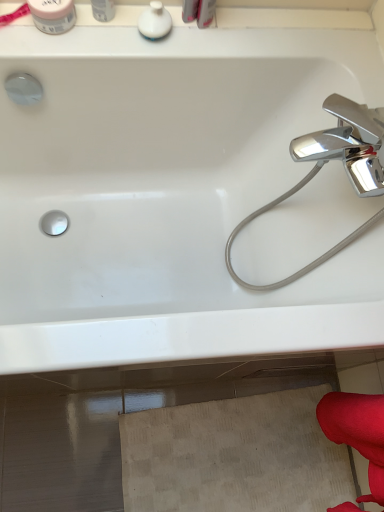
This screenshot has width=384, height=512. Describe the element at coordinates (53, 15) in the screenshot. I see `white matte jar at upper left, the 1th toiletry positioned from the left` at that location.

How much space does white glossy container at upper left, placed as the 2th toiletry when sorted from left to right, occupy horizontally?

white glossy container at upper left, placed as the 2th toiletry when sorted from left to right, is 2.18 inches in width.

Describe the element at coordinates (169, 194) in the screenshot. The height and width of the screenshot is (512, 384). I see `white glossy bathtub at upper center` at that location.

At what (x,y) coordinates should I click in order to perform the action: click on white matte jar at upper left, the 3th toiletry viewed from the right. Please return your answer as a coordinate pair (x, y). Looking at the image, I should click on (53, 15).

Is white glossy container at upper left, acting as the 2th toiletry starting from the right, aimed at white glossy bathtub at upper center?

No, white glossy container at upper left, acting as the 2th toiletry starting from the right, is not oriented towards white glossy bathtub at upper center.

From a real-world perspective, is white glossy container at upper left, placed as the 2th toiletry when sorted from left to right, located beneath white glossy bathtub at upper center?

Actually, white glossy container at upper left, placed as the 2th toiletry when sorted from left to right, is physically above white glossy bathtub at upper center in the real world.

Can you tell me how much white glossy container at upper left, placed as the 2th toiletry when sorted from left to right, and white glossy bathtub at upper center differ in facing direction?

The facing directions of white glossy container at upper left, placed as the 2th toiletry when sorted from left to right, and white glossy bathtub at upper center are 1.41 degrees apart.

Based on the photo, do you think white glossy container at upper left, placed as the 2th toiletry when sorted from left to right, is within white glossy bathtub at upper center, or outside of it?

white glossy container at upper left, placed as the 2th toiletry when sorted from left to right, is not enclosed by white glossy bathtub at upper center.

Is white glossy soap dispenser at upper center, which ranks as the first toiletry in right-to-left order, facing away from white matte jar at upper left, the 1th toiletry positioned from the left?

No, white glossy soap dispenser at upper center, which ranks as the first toiletry in right-to-left order, is not facing the opposite direction of white matte jar at upper left, the 1th toiletry positioned from the left.

Locate an element on the screen. The height and width of the screenshot is (512, 384). the 1st toiletry positioned above the white glossy soap dispenser at upper center, the third toiletry in the left-to-right sequence (from a real-world perspective) is located at coordinates (53, 15).

Can you confirm if white glossy soap dispenser at upper center, the third toiletry in the left-to-right sequence, is wider than white matte jar at upper left, the 3th toiletry viewed from the right?

Incorrect, the width of white glossy soap dispenser at upper center, the third toiletry in the left-to-right sequence, does not surpass that of white matte jar at upper left, the 3th toiletry viewed from the right.

Considering the sizes of objects white glossy bathtub at upper center and white matte jar at upper left, the 1th toiletry positioned from the left, in the image provided, who is smaller, white glossy bathtub at upper center or white matte jar at upper left, the 1th toiletry positioned from the left,?

white matte jar at upper left, the 1th toiletry positioned from the left, is smaller.

From the image's perspective, is white glossy bathtub at upper center beneath white matte jar at upper left, the 1th toiletry positioned from the left?

Correct, white glossy bathtub at upper center appears lower than white matte jar at upper left, the 1th toiletry positioned from the left, in the image.

Is there a large distance between white glossy bathtub at upper center and white matte jar at upper left, the 1th toiletry positioned from the left?

No, there isn't a large distance between white glossy bathtub at upper center and white matte jar at upper left, the 1th toiletry positioned from the left.

In terms of height, does white glossy container at upper left, acting as the 2th toiletry starting from the right, look taller or shorter compared to white glossy soap dispenser at upper center, the third toiletry in the left-to-right sequence?

white glossy container at upper left, acting as the 2th toiletry starting from the right, is taller than white glossy soap dispenser at upper center, the third toiletry in the left-to-right sequence.

Identify the location of the 2nd toiletry in front of the white glossy soap dispenser at upper center, which ranks as the first toiletry in right-to-left order. This screenshot has width=384, height=512. (103, 10).

From the picture: What's the angular difference between white glossy container at upper left, placed as the 2th toiletry when sorted from left to right, and white glossy soap dispenser at upper center, which ranks as the first toiletry in right-to-left order,'s facing directions?

They differ by 0.00329 degrees in their facing directions.

Which object is wider, white glossy container at upper left, placed as the 2th toiletry when sorted from left to right, or white glossy soap dispenser at upper center, which ranks as the first toiletry in right-to-left order?

With larger width is white glossy soap dispenser at upper center, which ranks as the first toiletry in right-to-left order.

Is white matte jar at upper left, the 3th toiletry viewed from the right, not near white glossy bathtub at upper center?

No, white matte jar at upper left, the 3th toiletry viewed from the right, is not far away from white glossy bathtub at upper center.

How much distance is there between white matte jar at upper left, the 3th toiletry viewed from the right, and white glossy bathtub at upper center?

They are 19.89 inches apart.

Is point (65, 30) farther from camera compared to point (205, 128)?

No, (65, 30) is in front of (205, 128).

From the picture: Which is more to the left, white matte jar at upper left, the 3th toiletry viewed from the right, or white glossy container at upper left, placed as the 2th toiletry when sorted from left to right?

From the viewer's perspective, white matte jar at upper left, the 3th toiletry viewed from the right, appears more on the left side.

Is white matte jar at upper left, the 1th toiletry positioned from the left, taller than white glossy container at upper left, placed as the 2th toiletry when sorted from left to right?

In fact, white matte jar at upper left, the 1th toiletry positioned from the left, may be shorter than white glossy container at upper left, placed as the 2th toiletry when sorted from left to right.

Could you tell me if white matte jar at upper left, the 3th toiletry viewed from the right, is turned towards white glossy container at upper left, placed as the 2th toiletry when sorted from left to right?

No, white matte jar at upper left, the 3th toiletry viewed from the right, is not oriented towards white glossy container at upper left, placed as the 2th toiletry when sorted from left to right.

Does point (103, 21) appear closer or farther from the camera than point (61, 28)?

Point (103, 21).

From their relative heights in the image, would you say white glossy container at upper left, placed as the 2th toiletry when sorted from left to right, is taller or shorter than white matte jar at upper left, the 3th toiletry viewed from the right?

In the image, white glossy container at upper left, placed as the 2th toiletry when sorted from left to right, appears to be taller than white matte jar at upper left, the 3th toiletry viewed from the right.

Can you tell me how much white glossy container at upper left, placed as the 2th toiletry when sorted from left to right, and white matte jar at upper left, the 1th toiletry positioned from the left, differ in facing direction?

The facing directions of white glossy container at upper left, placed as the 2th toiletry when sorted from left to right, and white matte jar at upper left, the 1th toiletry positioned from the left, are 0.00148 degrees apart.

Looking at the image, does white glossy container at upper left, acting as the 2th toiletry starting from the right, seem bigger or smaller compared to white matte jar at upper left, the 1th toiletry positioned from the left?

Considering their sizes, white glossy container at upper left, acting as the 2th toiletry starting from the right, takes up less space than white matte jar at upper left, the 1th toiletry positioned from the left.

From the white glossy bathtub at upper center, count 1st toiletrys backward and point to it. Please provide its 2D coordinates.

[(103, 10)]

Starting from the white glossy soap dispenser at upper center, which ranks as the first toiletry in right-to-left order, which toiletry is the 2nd one to the left? Please provide its 2D coordinates.

[(53, 15)]

When comparing their distances from white glossy container at upper left, acting as the 2th toiletry starting from the right, does white glossy soap dispenser at upper center, which ranks as the first toiletry in right-to-left order, or white glossy bathtub at upper center seem further?

white glossy bathtub at upper center.

Looking at the image, which one is located closer to white glossy container at upper left, acting as the 2th toiletry starting from the right, white matte jar at upper left, the 1th toiletry positioned from the left, or white glossy soap dispenser at upper center, the third toiletry in the left-to-right sequence?

white matte jar at upper left, the 1th toiletry positioned from the left, lies closer to white glossy container at upper left, acting as the 2th toiletry starting from the right, than the other object.

From the image, which object appears to be nearer to white glossy container at upper left, acting as the 2th toiletry starting from the right, white glossy bathtub at upper center or white glossy soap dispenser at upper center, the third toiletry in the left-to-right sequence?

white glossy soap dispenser at upper center, the third toiletry in the left-to-right sequence, is closer to white glossy container at upper left, acting as the 2th toiletry starting from the right.

Considering their positions, is white glossy container at upper left, placed as the 2th toiletry when sorted from left to right, positioned further to white glossy bathtub at upper center than white glossy soap dispenser at upper center, the third toiletry in the left-to-right sequence?

Based on the image, white glossy container at upper left, placed as the 2th toiletry when sorted from left to right, appears to be further to white glossy bathtub at upper center.

Considering their positions, is white glossy container at upper left, placed as the 2th toiletry when sorted from left to right, positioned closer to white glossy soap dispenser at upper center, the third toiletry in the left-to-right sequence, than white glossy bathtub at upper center?

Based on the image, white glossy container at upper left, placed as the 2th toiletry when sorted from left to right, appears to be nearer to white glossy soap dispenser at upper center, the third toiletry in the left-to-right sequence.

Which object lies further to the anchor point white glossy soap dispenser at upper center, which ranks as the first toiletry in right-to-left order, white matte jar at upper left, the 1th toiletry positioned from the left, or white glossy container at upper left, placed as the 2th toiletry when sorted from left to right?

Among the two, white matte jar at upper left, the 1th toiletry positioned from the left, is located further to white glossy soap dispenser at upper center, which ranks as the first toiletry in right-to-left order.

Which object lies nearer to the anchor point white matte jar at upper left, the 3th toiletry viewed from the right, white glossy bathtub at upper center or white glossy soap dispenser at upper center, which ranks as the first toiletry in right-to-left order?

The object closer to white matte jar at upper left, the 3th toiletry viewed from the right, is white glossy soap dispenser at upper center, which ranks as the first toiletry in right-to-left order.

Consider the image. Estimate the real-world distances between objects in this image. Which object is closer to white glossy container at upper left, acting as the 2th toiletry starting from the right, white glossy bathtub at upper center or white matte jar at upper left, the 1th toiletry positioned from the left?

white matte jar at upper left, the 1th toiletry positioned from the left, is closer to white glossy container at upper left, acting as the 2th toiletry starting from the right.

The height and width of the screenshot is (512, 384). Find the location of `toiletry between white matte jar at upper left, the 1th toiletry positioned from the left, and white glossy soap dispenser at upper center, which ranks as the first toiletry in right-to-left order, from left to right`. toiletry between white matte jar at upper left, the 1th toiletry positioned from the left, and white glossy soap dispenser at upper center, which ranks as the first toiletry in right-to-left order, from left to right is located at coordinates (103, 10).

Where is `toiletry between white matte jar at upper left, the 1th toiletry positioned from the left, and white glossy bathtub at upper center in the up-down direction`? Image resolution: width=384 pixels, height=512 pixels. toiletry between white matte jar at upper left, the 1th toiletry positioned from the left, and white glossy bathtub at upper center in the up-down direction is located at coordinates (155, 21).